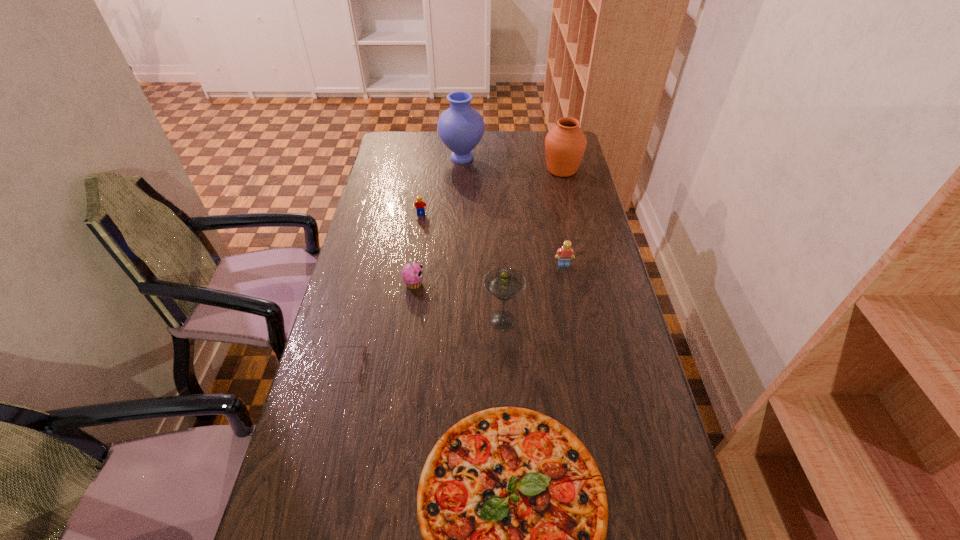
Where is `Lego at the right edge`? Lego at the right edge is located at coordinates (564, 254).

Locate an element on the screen. The width and height of the screenshot is (960, 540). vacant space at the far edge of the desktop is located at coordinates (501, 147).

I want to click on vacant space at the left edge of the desktop, so click(x=349, y=346).

I want to click on free region at the right edge of the desktop, so click(x=613, y=330).

This screenshot has height=540, width=960. Identify the location of free space between the sixth nearest object and the urn. (492, 192).

Locate an element on the screen. This screenshot has height=540, width=960. blank region between the third nearest object and the tallest object is located at coordinates (482, 239).

Find the location of a particular element. The height and width of the screenshot is (540, 960). free area in between the fourth nearest object and the vase is located at coordinates (438, 221).

At what (x,y) coordinates should I click in order to perform the action: click on unoccupied area between the left Lego and the martini. Please return your answer as a coordinate pair (x, y). The height and width of the screenshot is (540, 960). Looking at the image, I should click on (462, 267).

At what (x,y) coordinates should I click in order to perform the action: click on empty location between the sixth farthest object and the urn. Please return your answer as a coordinate pair (x, y). This screenshot has width=960, height=540. Looking at the image, I should click on (532, 245).

Point out which object is positioned as the sixth nearest to the pizza. Please provide its 2D coordinates. Your answer should be formatted as a tuple, i.e. [(x, y)], where the tuple contains the x and y coordinates of a point satisfying the conditions above.

[(565, 144)]